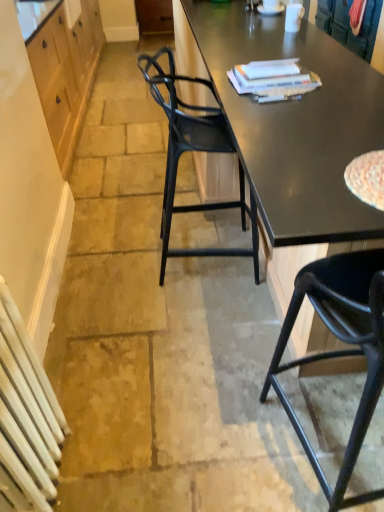
Where is `vacant space in front of black plastic chair at center, acting as the 2th chair starting from the front`? This screenshot has height=512, width=384. vacant space in front of black plastic chair at center, acting as the 2th chair starting from the front is located at coordinates (172, 332).